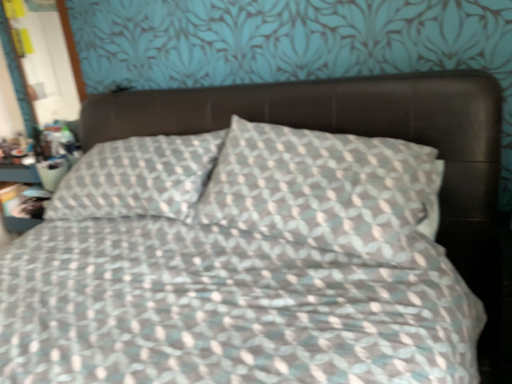
I want to click on wooden table at lower left, so click(x=17, y=223).

This screenshot has height=384, width=512. What do you see at coordinates (17, 223) in the screenshot? I see `wooden table at lower left` at bounding box center [17, 223].

At what (x,y) coordinates should I click in order to perform the action: click on wooden table at lower left. Please return your answer as a coordinate pair (x, y). Looking at the image, I should click on (17, 223).